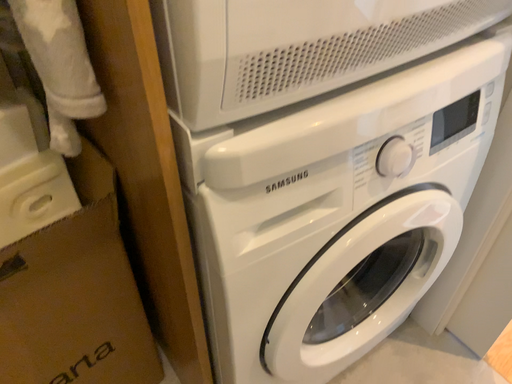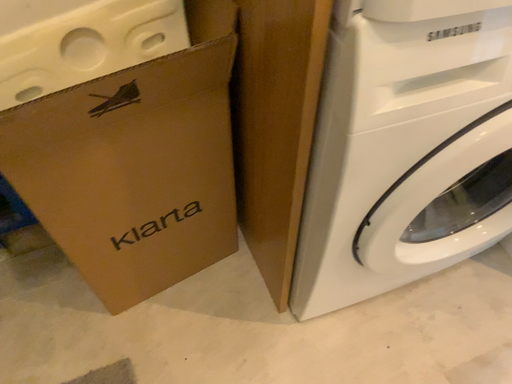
Question: How did the camera likely rotate when shooting the video?

Choices:
 (A) rotated upward
 (B) rotated downward

Answer: (B)